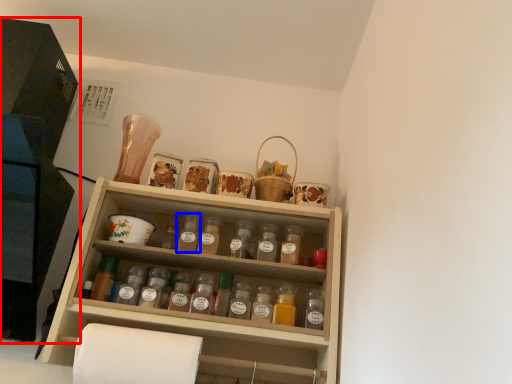
Question: Which point is further to the camera, cabinetry (highlighted by a red box) or bottle (highlighted by a blue box)?

Choices:
 (A) cabinetry
 (B) bottle

Answer: (B)